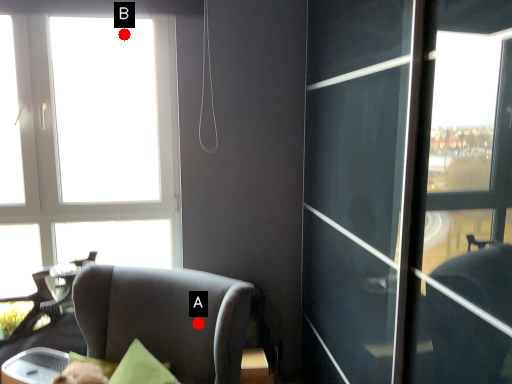
Question: Two points are circled on the image, labeled by A and B beside each circle. Which point is closer to the camera taking this photo?

Choices:
 (A) A is closer
 (B) B is closer

Answer: (A)